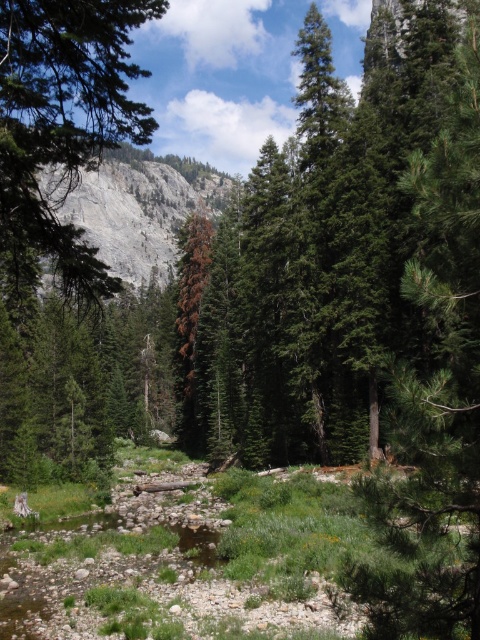
Between green textured tree at center and gray rock formation at upper left, which one has more height?

gray rock formation at upper left is taller.

Is green textured tree at center thinner than gray rock formation at upper left?

Indeed, green textured tree at center has a lesser width compared to gray rock formation at upper left.

In order to click on green textured tree at center in this screenshot , I will do (x=62, y=125).

I want to click on green textured tree at center, so [x=62, y=125].

Between green textured pine tree at right and green textured tree at center, which one is positioned higher?

green textured tree at center

Does point (466, 529) come in front of point (50, 157)?

That is True.

The height and width of the screenshot is (640, 480). I want to click on green textured pine tree at right, so click(434, 392).

In the scene shown: Measure the distance from green textured pine tree at right to gray rock formation at upper left.

They are 101.33 meters apart.

Between point (440, 292) and point (157, 246), which one is positioned in front?

Point (440, 292)

This screenshot has width=480, height=640. In order to click on green textured pine tree at right in this screenshot , I will do `click(434, 392)`.